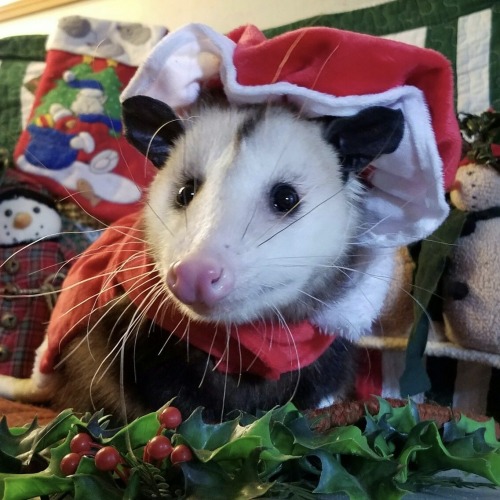
The height and width of the screenshot is (500, 500). Find the location of `wicker basket`. wicker basket is located at coordinates (345, 418).